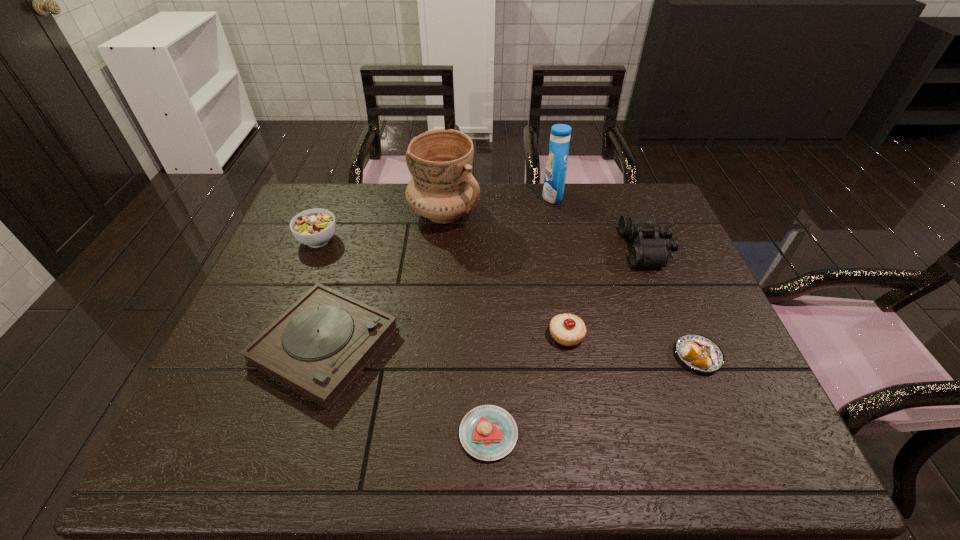
This screenshot has width=960, height=540. In the image, there is a desktop. What are the coordinates of `free region at the far left corner` in the screenshot? It's located at (312, 204).

Identify the location of vacant position at the far right corner of the desktop. The image size is (960, 540). pos(653,201).

This screenshot has height=540, width=960. I want to click on free space between the soup bowl and the tallest pastry, so click(443, 288).

You are a GUI agent. You are given a task and a screenshot of the screen. Output one action in this format:
    pyautogui.click(x=<x>, y=<y>)
    Task: Click on the free space between the rightmost pastry and the second pastry from right to left
    
    Given the screenshot: What is the action you would take?
    pyautogui.click(x=632, y=346)

This screenshot has width=960, height=540. Identify the location of vacant area between the pottery and the nearest pastry. (467, 323).

Locate an element on the screen. Image resolution: width=960 pixels, height=540 pixels. empty space between the phonograph record and the nearest pastry is located at coordinates (407, 389).

The width and height of the screenshot is (960, 540). In order to click on vacant point located between the rightmost pastry and the pottery in this screenshot , I will do `click(570, 285)`.

At what (x,y) coordinates should I click in order to perform the action: click on empty space between the second pastry from left to right and the nearest pastry. Please return your answer as a coordinate pair (x, y). This screenshot has height=540, width=960. Looking at the image, I should click on (527, 384).

This screenshot has height=540, width=960. Find the location of `free space between the detergent and the pottery`. free space between the detergent and the pottery is located at coordinates (498, 205).

At what (x,y) coordinates should I click in order to perform the action: click on vacant area that lies between the sixth tallest object and the rightmost pastry. Please return your answer as a coordinate pair (x, y). Looking at the image, I should click on (511, 350).